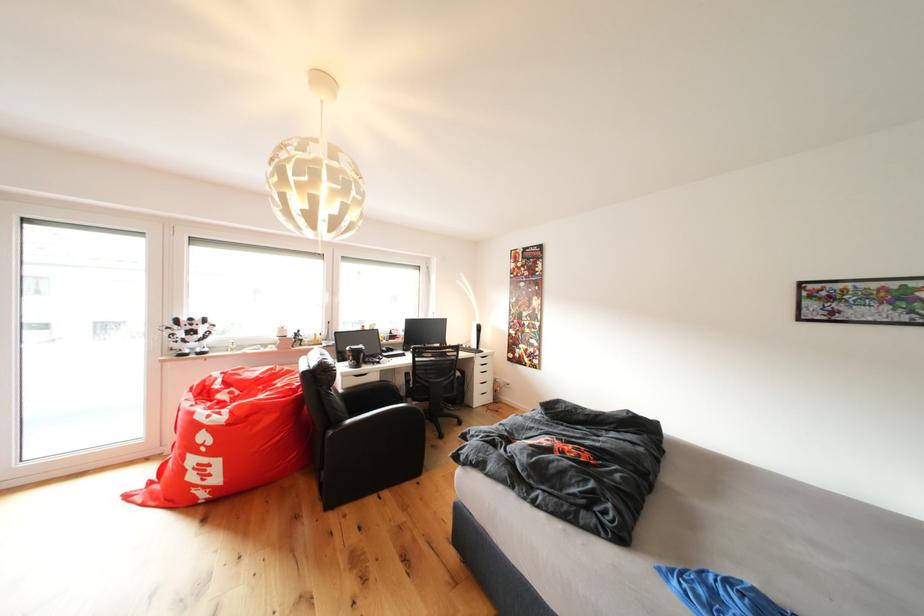
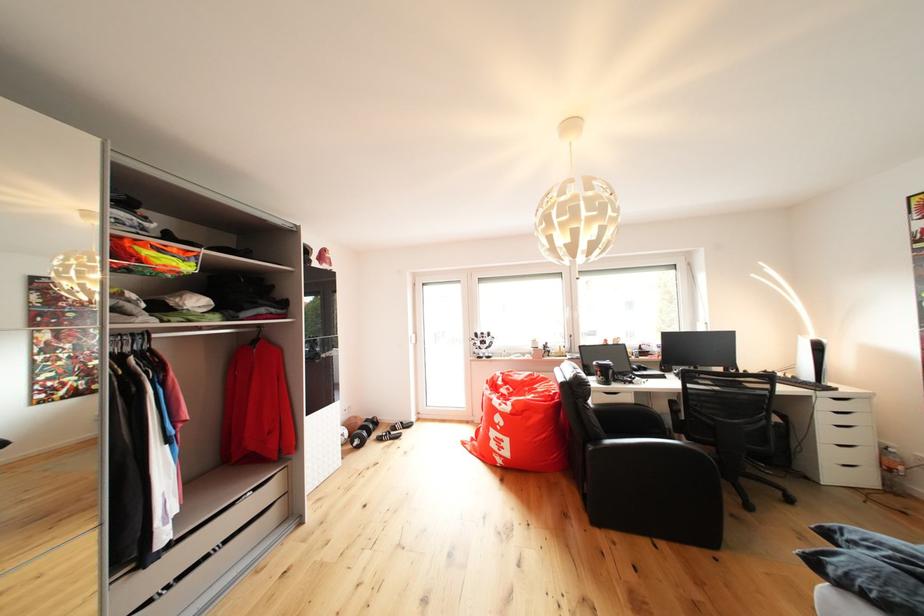
In the second image, find the point that corresponds to point 419,403 in the first image.

(686, 439)